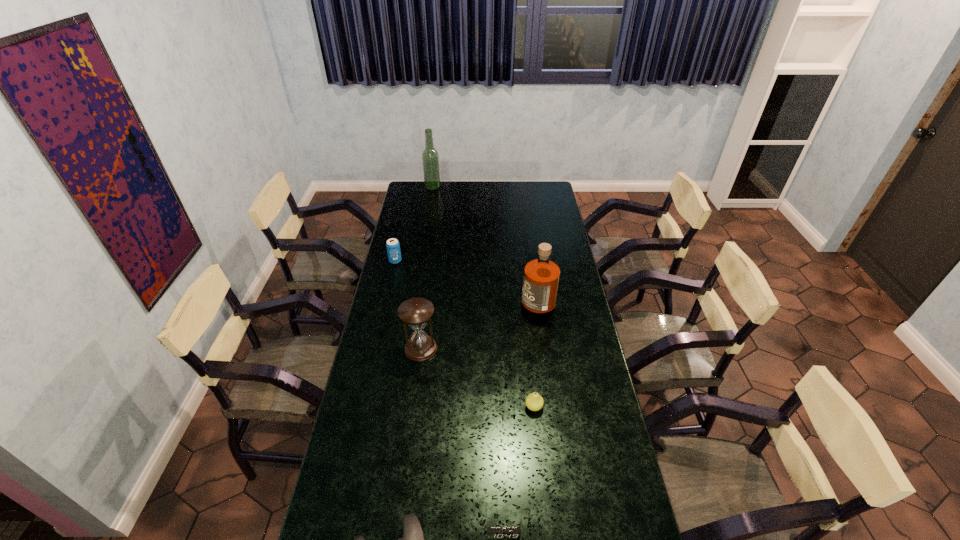
The image size is (960, 540). In order to click on alarm clock in this screenshot , I will do `click(492, 532)`.

Where is `vacant space located on the front of the farther liquor`? The image size is (960, 540). vacant space located on the front of the farther liquor is located at coordinates (431, 198).

The image size is (960, 540). I want to click on vacant space situated 0.380m on the front label of the fifth nearest object, so click(x=432, y=299).

You are a GUI agent. You are given a task and a screenshot of the screen. Output one action in this format:
    pyautogui.click(x=<x>, y=<y>)
    Task: Click on the free space located on the front label of the fifth nearest object
    Image resolution: width=960 pixels, height=540 pixels.
    Given the screenshot: What is the action you would take?
    pyautogui.click(x=504, y=299)

Locate an element on the screen. This screenshot has height=540, width=960. vacant point located on the front label of the fifth nearest object is located at coordinates (504, 299).

I want to click on vacant space located on the right of the fourth nearest object, so click(x=461, y=348).

Find the location of a particular element. The width and height of the screenshot is (960, 540). free spot located 0.080m on the right of the sixth nearest object is located at coordinates (419, 261).

At what (x,y) coordinates should I click in order to perform the action: click on vacant space located on the left of the third nearest object. Please return your answer as a coordinate pair (x, y). Looking at the image, I should click on (425, 407).

Where is `object at the far edge`? This screenshot has width=960, height=540. object at the far edge is located at coordinates (430, 158).

I want to click on liquor that is at the left edge, so click(x=430, y=158).